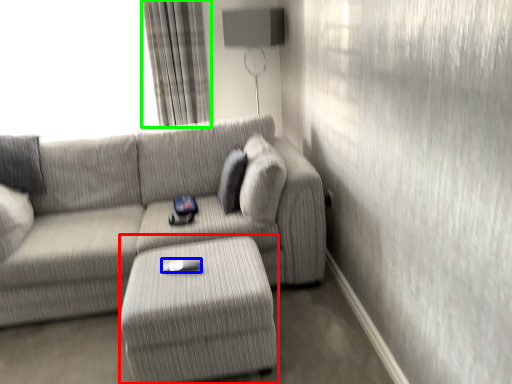
Question: Which object is positioned farthest from table (highlighted by a red box)? Select from Wii controller (highlighted by a blue box) and curtain (highlighted by a green box).

Choices:
 (A) Wii controller
 (B) curtain

Answer: (B)